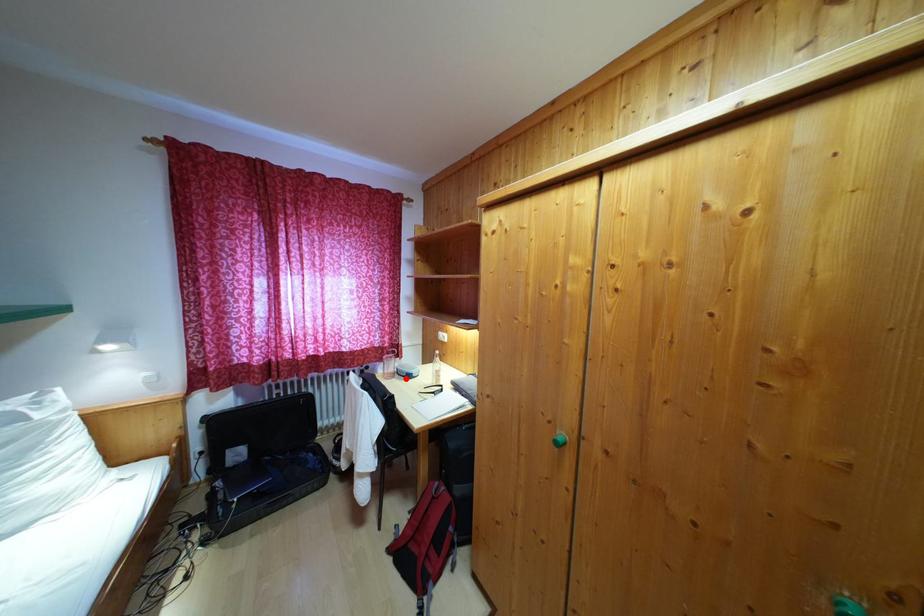
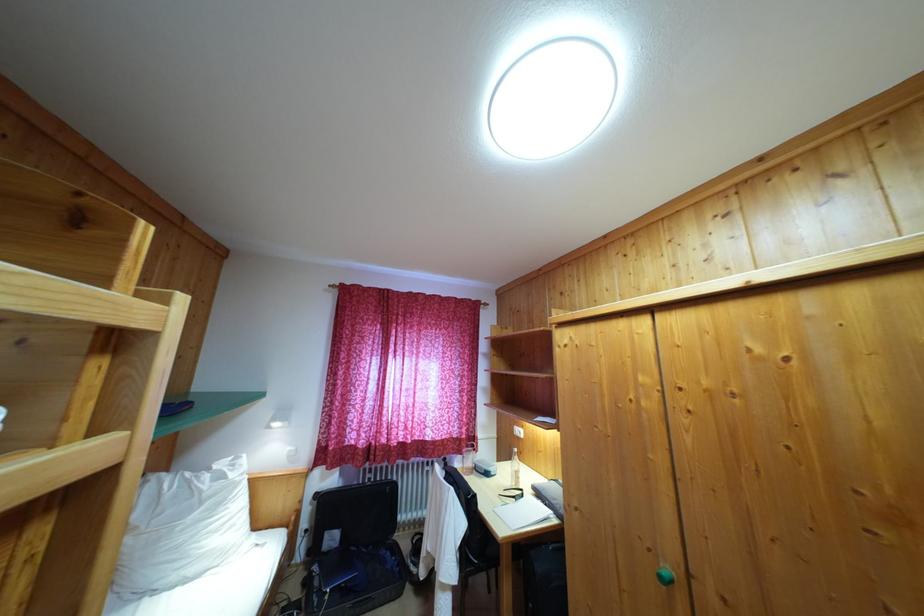
Question: I am providing you with two images of the same scene from different viewpoints. Image1 has a red point marked. In image2, the corresponding 3D location appears at what relative position? Reply with the corresponding letter.

Choices:
 (A) Closer
 (B) Farther

Answer: (B)